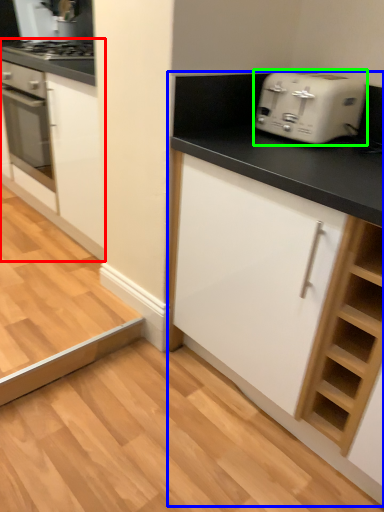
Question: Which is nearer to the cabinetry (highlighted by a red box)? cabinetry (highlighted by a blue box) or toaster (highlighted by a green box).

Choices:
 (A) cabinetry
 (B) toaster

Answer: (A)